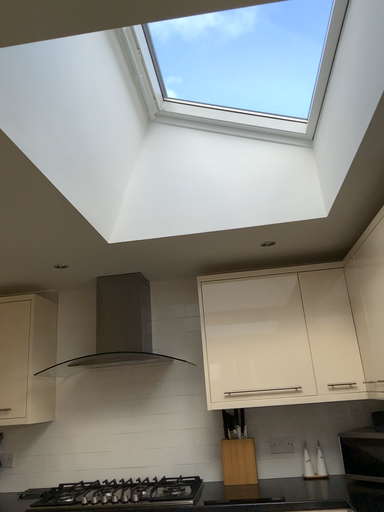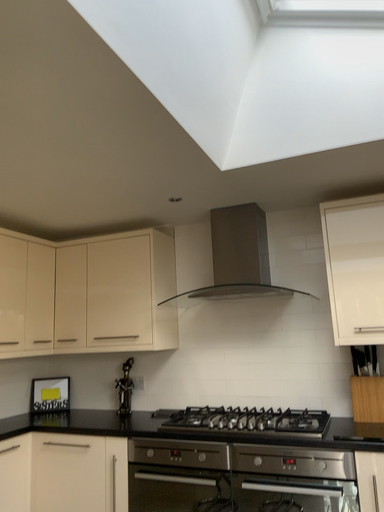
Question: Which way did the camera rotate in the video?

Choices:
 (A) rotated left
 (B) rotated right

Answer: (A)